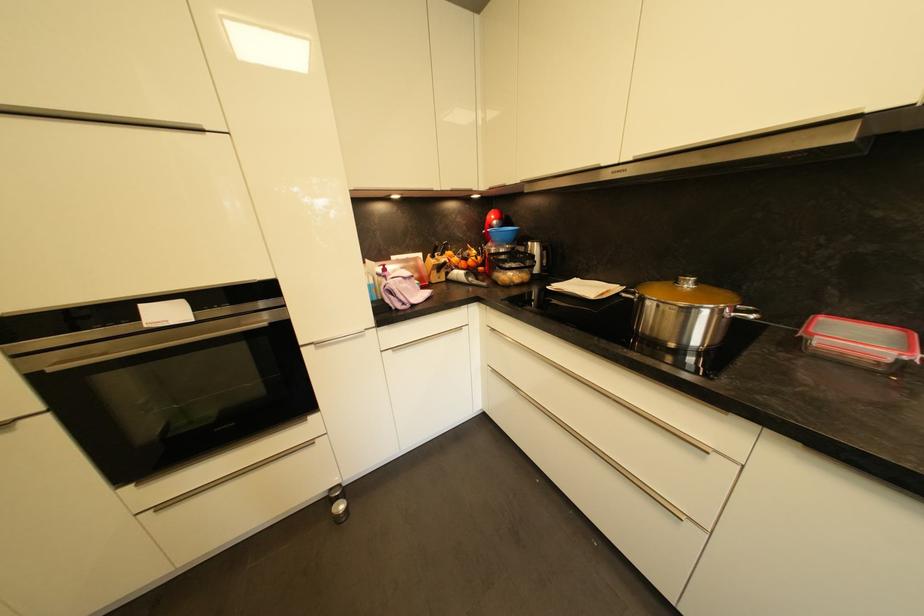
Find the location of a particular element. oven door handle is located at coordinates (140, 355).